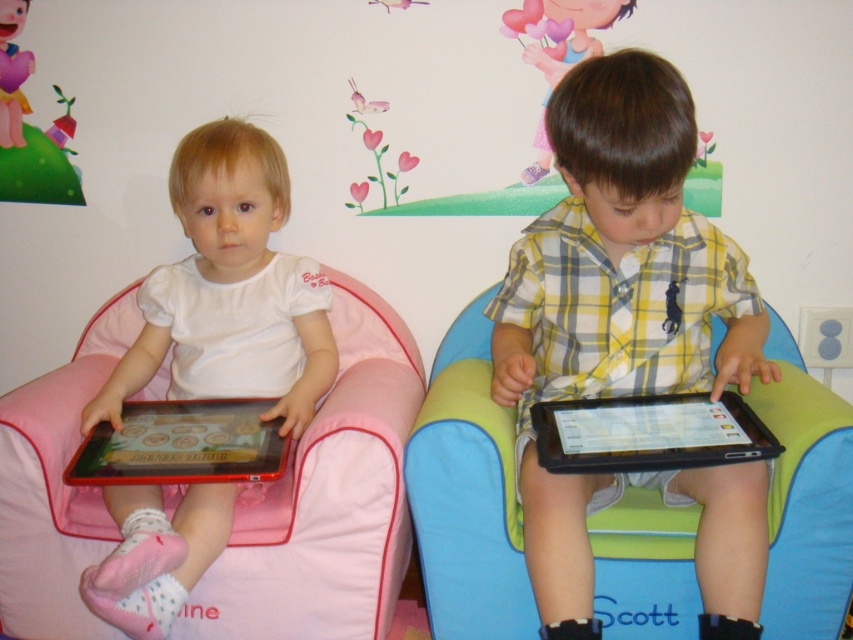
Question: Which is nearer to the yellow plaid shirt at center?

Choices:
 (A) pink fabric bean bag chair at left
 (B) matte plastic tablet at left
 (C) matte pink heart at upper left

Answer: (A)

Question: Among these objects, which one is farthest from the camera?

Choices:
 (A) pink fabric bean bag chair at left
 (B) black plastic tablet at center
 (C) matte pink heart at upper left

Answer: (C)

Question: Which is nearer to the matte pink heart at upper left?

Choices:
 (A) pink fabric bean bag chair at left
 (B) pastel heart balloons at upper center
 (C) black plastic tablet at center

Answer: (A)

Question: Where is matte plastic tablet at left located in relation to pastel heart balloons at upper center in the image?

Choices:
 (A) below
 (B) above

Answer: (A)

Question: Is pink fabric bean bag chair at left wider than matte pink heart at upper left?

Choices:
 (A) no
 (B) yes

Answer: (B)

Question: Is black plastic tablet at center further to camera compared to pastel heart balloons at upper center?

Choices:
 (A) no
 (B) yes

Answer: (A)